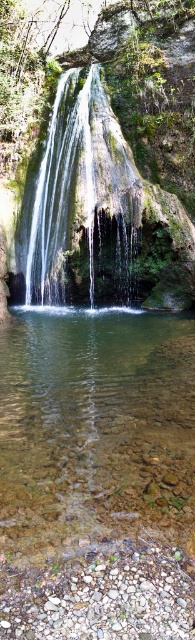
You are a hiker who wants to cross the pool at the base of the waterfall. You notice two areas of water in the center. The first is labeled as clear glass water at center and the second as clear water at center. Which area is narrower in width and safer to step on?

The clear glass water at center is narrower in width than the clear water at center, making it safer to step on.

Looking at this image, you are a hiker who wants to cross the pool at the bottom of the waterfall. You see the clear glass water at center and the smooth gray rock at bottom center. Which object should you step on to avoid getting your feet wet?

The smooth gray rock at bottom center is located below the clear glass water at center, so stepping on it will keep your feet dry.